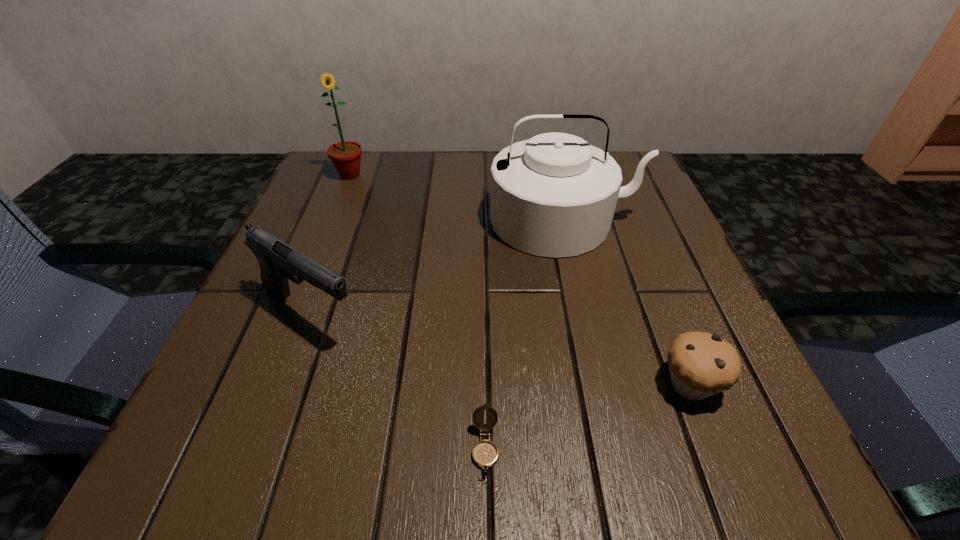
Find the location of a particular element. The image size is (960, 540). object that is at the far right corner is located at coordinates (x=554, y=195).

Locate an element on the screen. vacant area at the far edge of the desktop is located at coordinates (471, 156).

In the image, there is a desktop. At what (x,y) coordinates should I click in order to perform the action: click on free space at the near edge. Please return your answer as a coordinate pair (x, y). Looking at the image, I should click on (618, 441).

In order to click on blank space at the left edge in this screenshot , I will do 259,396.

The width and height of the screenshot is (960, 540). In order to click on vacant space at the right edge of the desktop in this screenshot , I will do `click(687, 303)`.

This screenshot has width=960, height=540. In order to click on free space at the far left corner of the desktop in this screenshot , I will do `click(352, 200)`.

You are a GUI agent. You are given a task and a screenshot of the screen. Output one action in this format:
    pyautogui.click(x=<x>, y=<y>)
    Task: Click on the vacant region at the far right corner of the desktop
    Image resolution: width=960 pixels, height=540 pixels.
    Given the screenshot: What is the action you would take?
    pyautogui.click(x=621, y=203)

Find the location of a particular element. The image size is (960, 540). vacant space that is in between the third shortest object and the kettle is located at coordinates (437, 267).

Identify the location of blank region between the compass and the third farthest object. (397, 382).

Find the location of a particular element. The height and width of the screenshot is (540, 960). unoccupied area between the muffin and the gun is located at coordinates (500, 349).